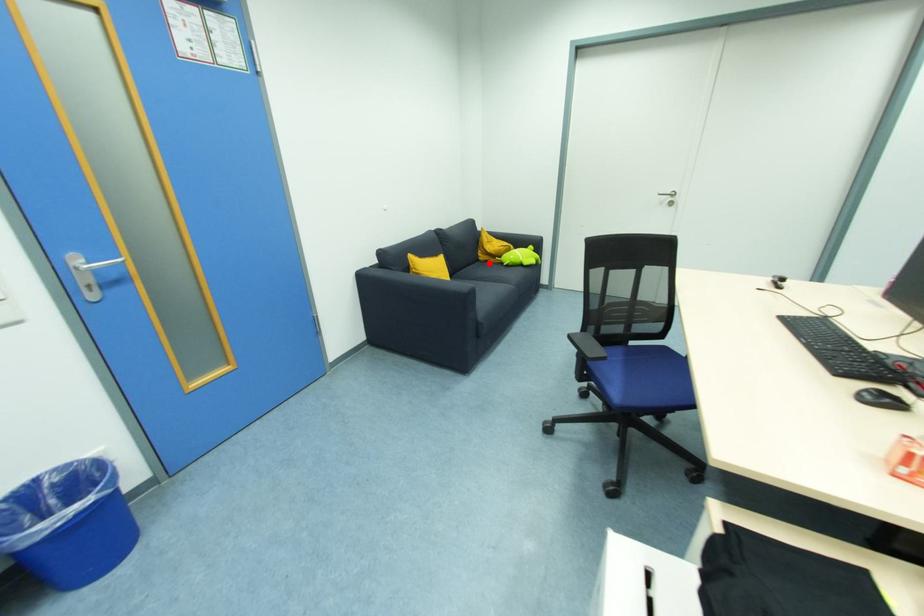
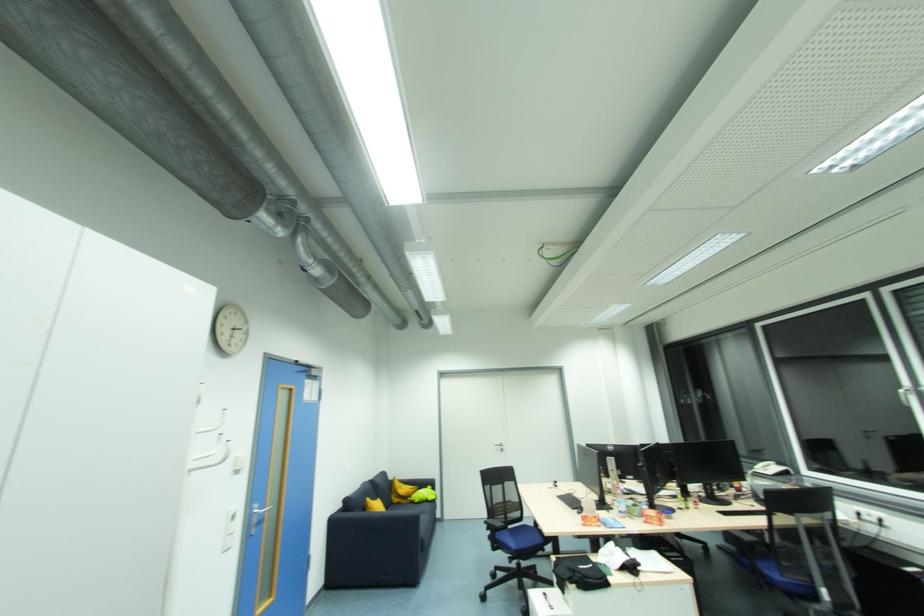
Find the pixel in the second image that matches the highlighted location in the first image.

(400, 505)